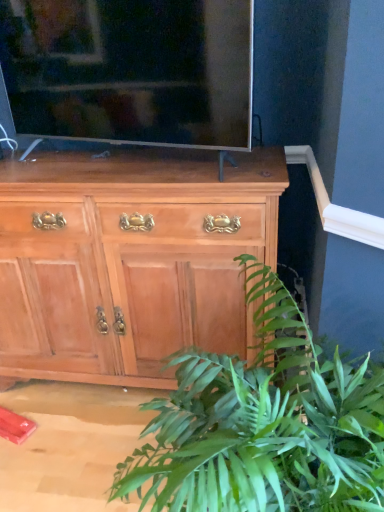
The image size is (384, 512). What do you see at coordinates (128, 261) in the screenshot?
I see `light brown wood cabinet at center` at bounding box center [128, 261].

Where is `matte black tv at upper center`? The height and width of the screenshot is (512, 384). matte black tv at upper center is located at coordinates (130, 69).

Which is in front, point (148, 188) or point (18, 109)?

The point (148, 188) is in front.

Considering the sizes of objects light brown wood cabinet at center and matte black tv at upper center in the image provided, who is shorter, light brown wood cabinet at center or matte black tv at upper center?

matte black tv at upper center is shorter.

Find the location of a particular element. television above the light brown wood cabinet at center (from a real-world perspective) is located at coordinates (130, 69).

Can you tell me how much light brown wood cabinet at center and matte black tv at upper center differ in facing direction?

The facing directions of light brown wood cabinet at center and matte black tv at upper center are 19.8 degrees apart.

Is point (72, 281) positioned before point (288, 475)?

No, (72, 281) is further to viewer.

Based on the photo, from the image's perspective, is light brown wood cabinet at center below green leafy plant at lower right?

No.

Consider the image. Is light brown wood cabinet at center at the right side of green leafy plant at lower right?

In fact, light brown wood cabinet at center is to the left of green leafy plant at lower right.

Who is smaller, light brown wood cabinet at center or green leafy plant at lower right?

green leafy plant at lower right is smaller.

Locate an element on the screen. television that is on the left side of green leafy plant at lower right is located at coordinates (130, 69).

Considering the positions of objects green leafy plant at lower right and matte black tv at upper center in the image provided, who is behind, green leafy plant at lower right or matte black tv at upper center?

matte black tv at upper center is behind.

Is green leafy plant at lower right looking in the opposite direction of matte black tv at upper center?

green leafy plant at lower right does not have its back to matte black tv at upper center.

Considering the positions of point (210, 130) and point (192, 161), is point (210, 130) closer or farther from the camera than point (192, 161)?

Point (210, 130) is closer to the camera than point (192, 161).

In terms of size, does matte black tv at upper center appear bigger or smaller than light brown wood cabinet at center?

In the image, matte black tv at upper center appears to be smaller than light brown wood cabinet at center.

Is matte black tv at upper center positioned far away from light brown wood cabinet at center?

They are positioned close to each other.

Considering the sizes of objects matte black tv at upper center and light brown wood cabinet at center in the image provided, who is thinner, matte black tv at upper center or light brown wood cabinet at center?

With smaller width is matte black tv at upper center.

Where is `television on the left of green leafy plant at lower right`? The width and height of the screenshot is (384, 512). television on the left of green leafy plant at lower right is located at coordinates (130, 69).

In the scene shown: Can you tell me how much matte black tv at upper center and green leafy plant at lower right differ in facing direction?

The angle between the facing direction of matte black tv at upper center and the facing direction of green leafy plant at lower right is 26.4 degrees.

Considering the points (212, 137) and (236, 378), which point is behind, point (212, 137) or point (236, 378)?

The point (212, 137) is behind.

In the scene shown: In terms of height, does matte black tv at upper center look taller or shorter compared to green leafy plant at lower right?

Considering their sizes, matte black tv at upper center has less height than green leafy plant at lower right.

Does green leafy plant at lower right contain light brown wood cabinet at center?

Definitely not — light brown wood cabinet at center is not inside green leafy plant at lower right.

Which is behind, point (284, 478) or point (31, 197)?

The point (31, 197) is farther from the camera.

Looking at the image, does green leafy plant at lower right seem bigger or smaller compared to light brown wood cabinet at center?

In the image, green leafy plant at lower right appears to be smaller than light brown wood cabinet at center.

Considering the relative positions of green leafy plant at lower right and light brown wood cabinet at center in the image provided, is green leafy plant at lower right to the left or to the right of light brown wood cabinet at center?

Based on their positions, green leafy plant at lower right is located to the right of light brown wood cabinet at center.

Locate an element on the screen. The image size is (384, 512). chest of drawers on the left of the matte black tv at upper center is located at coordinates (128, 261).

The height and width of the screenshot is (512, 384). I want to click on the chest of drawers that is above the green leafy plant at lower right (from the image's perspective), so click(x=128, y=261).

Looking at the image, which one is located further to light brown wood cabinet at center, green leafy plant at lower right or matte black tv at upper center?

green leafy plant at lower right lies further to light brown wood cabinet at center than the other object.

From the image, which object appears to be farther from light brown wood cabinet at center, matte black tv at upper center or green leafy plant at lower right?

green leafy plant at lower right lies further to light brown wood cabinet at center than the other object.

When comparing their distances from matte black tv at upper center, does light brown wood cabinet at center or green leafy plant at lower right seem further?

green leafy plant at lower right lies further to matte black tv at upper center than the other object.

Estimate the real-world distances between objects in this image. Which object is closer to matte black tv at upper center, green leafy plant at lower right or light brown wood cabinet at center?

Based on the image, light brown wood cabinet at center appears to be nearer to matte black tv at upper center.

From the image, which object appears to be farther from green leafy plant at lower right, light brown wood cabinet at center or matte black tv at upper center?

The object further to green leafy plant at lower right is matte black tv at upper center.

Looking at the image, which one is located further to green leafy plant at lower right, matte black tv at upper center or light brown wood cabinet at center?

matte black tv at upper center is further to green leafy plant at lower right.

What are the coordinates of `chest of drawers between matte black tv at upper center and green leafy plant at lower right in the up-down direction` in the screenshot? It's located at (128, 261).